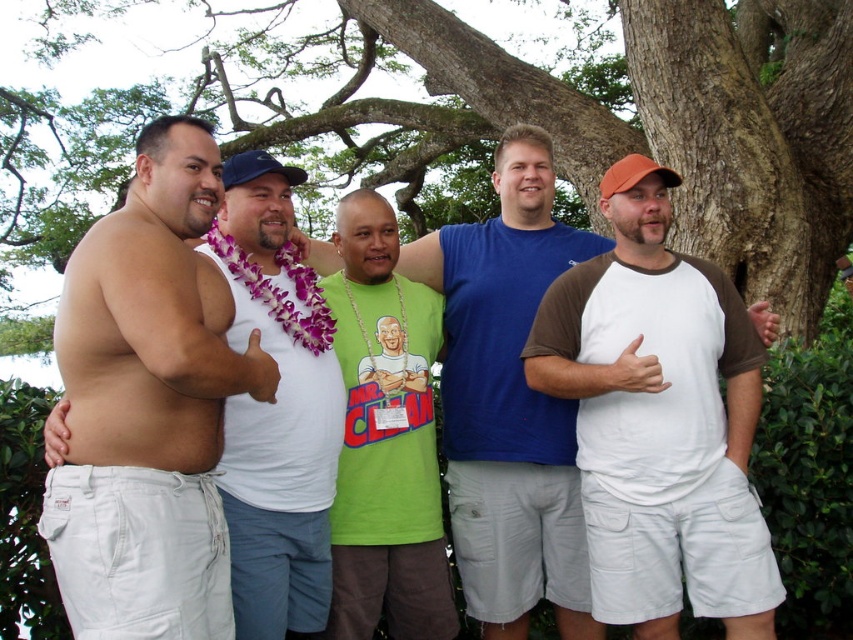
Who is taller, brown cotton t-shirt at center or white fabric tank top at center?

brown cotton t-shirt at center is taller.

Is brown cotton t-shirt at center wider than white fabric tank top at center?

Yes, brown cotton t-shirt at center is wider than white fabric tank top at center.

Which is behind, point (611, 468) or point (213, 257)?

Point (213, 257)

At what (x,y) coordinates should I click in order to perform the action: click on brown cotton t-shirt at center. Please return your answer as a coordinate pair (x, y). The width and height of the screenshot is (853, 640). Looking at the image, I should click on (656, 417).

Between brown cotton t-shirt at center and green fabric shirt at center, which one appears on the left side from the viewer's perspective?

green fabric shirt at center is more to the left.

Which of these two, brown cotton t-shirt at center or green fabric shirt at center, stands taller?

Standing taller between the two is brown cotton t-shirt at center.

Does point (733, 634) come behind point (416, 384)?

No, it is not.

Where is `brown cotton t-shirt at center`? brown cotton t-shirt at center is located at coordinates (656, 417).

Who is positioned more to the left, skinny white pants at left or green fabric shirt at center?

skinny white pants at left

Describe the element at coordinates (148, 404) in the screenshot. I see `skinny white pants at left` at that location.

I want to click on skinny white pants at left, so click(148, 404).